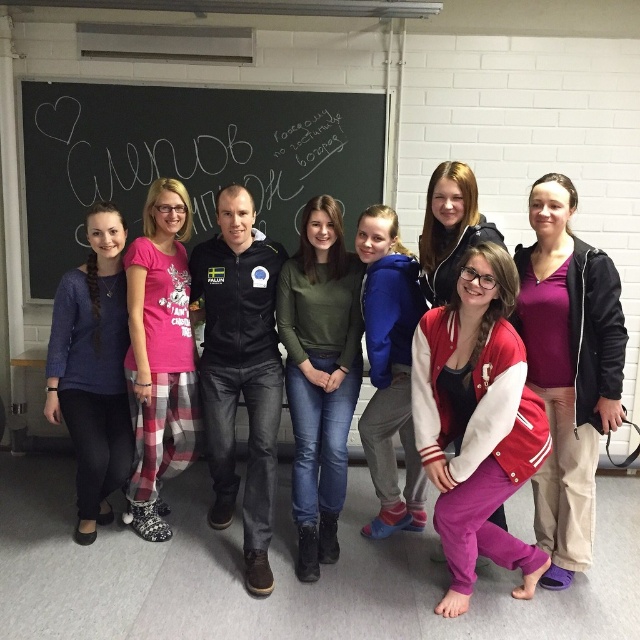
You are a photographer trying to capture a closeup of the black chalkboard at upper left and the black matte jacket at center. Since you want to focus on both objects equally, which one should you adjust the camera focus for first, considering their sizes?

The black chalkboard at upper left is shorter than black matte jacket at center, so you should focus on the black chalkboard at upper left first because it is smaller and requires precise framing.

Based on the photo, where is the green matte sweater at center located in the image?

The green matte sweater at center is located at point coordinates of (x=320, y=376).

You are a photographer standing in front of the group. You want to adjust the camera to capture both the vivid red velour jacket at center and the green matte sweater at center in the same frame. Given that your camera has a minimum focus distance of 50 centimeters, will you be able to capture both objects clearly?

The distance between the vivid red velour jacket at center and the green matte sweater at center is 66.10 centimeters. Since the camera requires a minimum focus distance of 50 centimeters, the 66.10 cm distance exceeds this requirement. Therefore, the photographer can capture both objects clearly in the same frame.